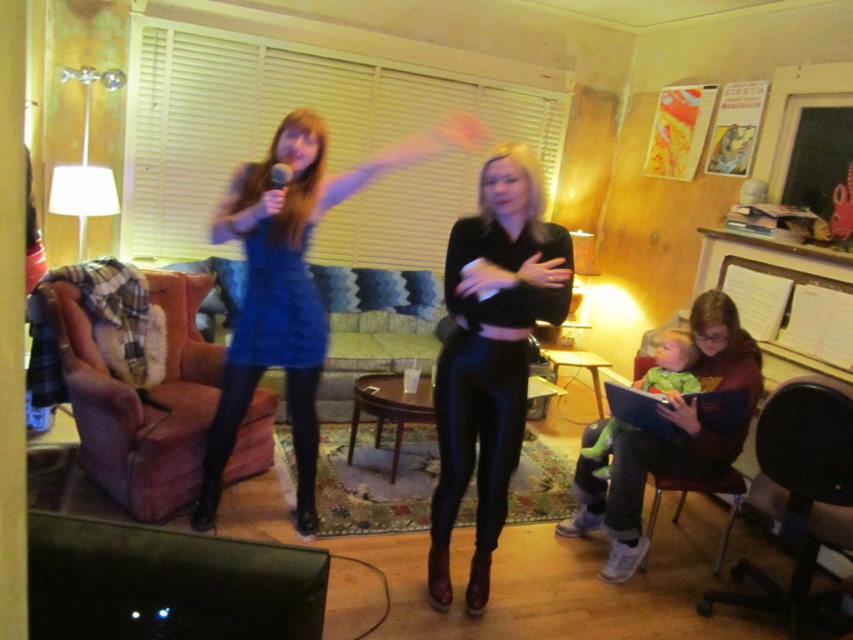
Question: Which point is farther from the camera taking this photo?

Choices:
 (A) (160, 285)
 (B) (289, 337)
 (C) (566, 252)

Answer: (A)

Question: Is shiny black pants at center wider than black leather armchair at lower right?

Choices:
 (A) yes
 (B) no

Answer: (B)

Question: Is black leather armchair at lower right positioned before green fabric armchair at lower right?

Choices:
 (A) yes
 (B) no

Answer: (A)

Question: Based on their relative distances, which object is farther from the green fabric armchair at lower right?

Choices:
 (A) plush pink armchair at left
 (B) black leather armchair at lower right
 (C) blue shiny dress at center

Answer: (A)

Question: Does black leather armchair at lower right appear on the right side of green fabric armchair at lower right?

Choices:
 (A) no
 (B) yes

Answer: (B)

Question: Among these points, which one is farthest from the camera?

Choices:
 (A) (598, 490)
 (B) (270, 154)

Answer: (A)